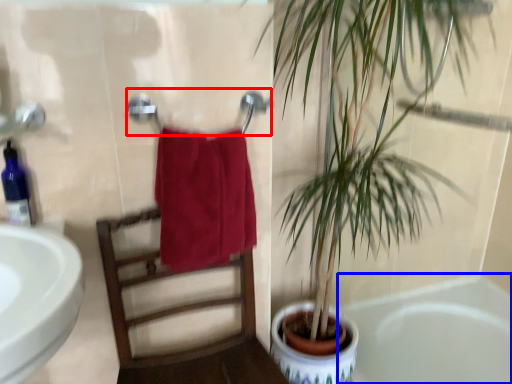
Question: Which point is closer to the camera, towel bar (highlighted by a red box) or bathtub (highlighted by a blue box)?

Choices:
 (A) towel bar
 (B) bathtub

Answer: (A)